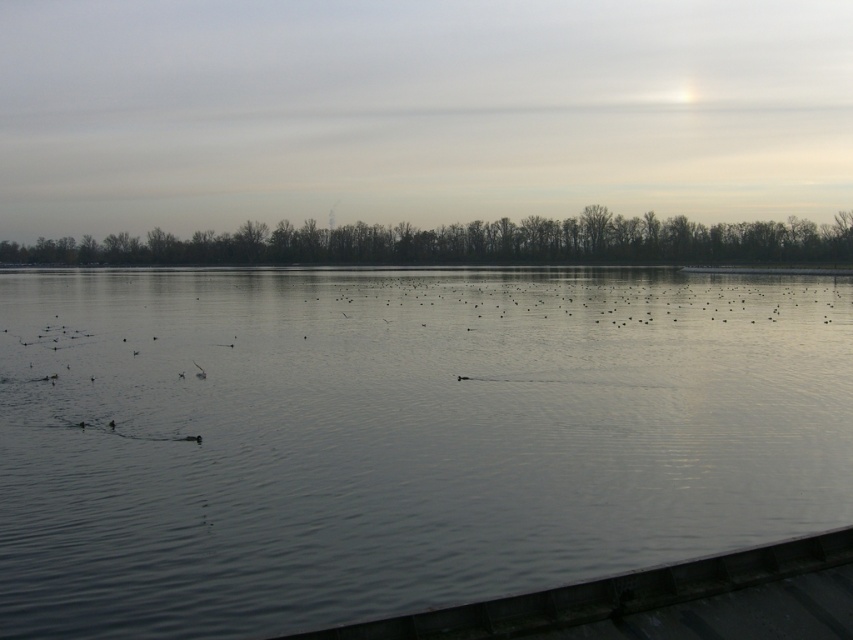
You are a photographer standing at the edge of the water. You want to capture a photo where the clear water at center and the silhouette bare trees at upper center are both visible. Which object will appear larger in the photo?

The clear water at center will appear larger in the photo because it is closer to the viewer than the silhouette bare trees at upper center.

You are standing on a dock and want to jump into the water. The safety rule states that you must be at least 25 feet away from the edge of the dock to avoid hitting the wooden planks below. Based on the image, can you safely jump into the clear water at center?

The clear water at center is 26.24 feet away from the viewer, which exceeds the minimum required distance of 25 feet. Therefore, you can safely jump into the clear water at center without hitting the wooden planks below.

You are standing on a dock and want to throw a stone into the clear water at center. If the stone travels in a straight line, will it hit the silhouette bare trees at upper center before reaching the water?

The clear water at center is 97.27 meters away from the silhouette bare trees at upper center. Since the trees are behind the water, the stone will hit the water first before reaching the trees.